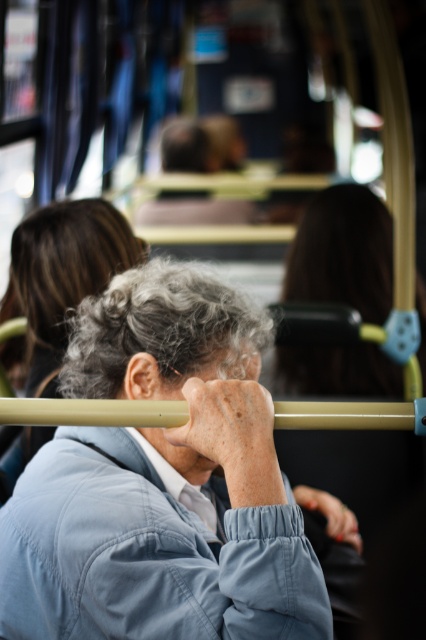
How far apart are dark brown hair at upper center and gray matte hair at center?

dark brown hair at upper center and gray matte hair at center are 1.23 meters apart from each other.

Looking at this image, does dark brown hair at upper center lie in front of gray matte hair at center?

No, dark brown hair at upper center is behind gray matte hair at center.

Is point (351, 392) positioned before point (160, 378)?

That is False.

Find the location of a particular element. This screenshot has height=640, width=426. dark brown hair at upper center is located at coordinates (342, 252).

Can you confirm if light blue fabric at center is positioned to the left of gray matte hair at center?

Correct, you'll find light blue fabric at center to the left of gray matte hair at center.

Which is more to the right, light blue fabric at center or gray matte hair at center?

gray matte hair at center

Where is `light blue fabric at center`? The width and height of the screenshot is (426, 640). light blue fabric at center is located at coordinates (63, 275).

Who is positioned more to the left, light blue fabric jacket at center or dark brown hair at upper center?

From the viewer's perspective, light blue fabric jacket at center appears more on the left side.

Is point (141, 605) farther from camera compared to point (290, 298)?

No, (141, 605) is in front of (290, 298).

The height and width of the screenshot is (640, 426). Identify the location of light blue fabric jacket at center. (161, 483).